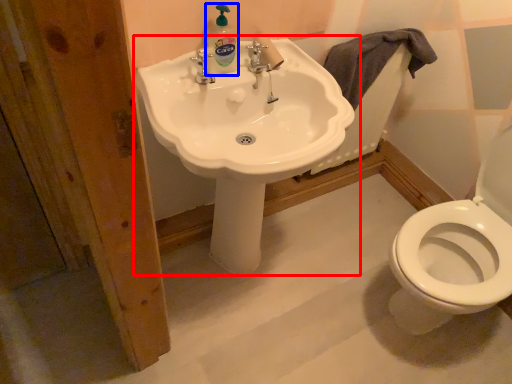
Question: Which point is closer to the camera, sink (highlighted by a red box) or cleaning product (highlighted by a blue box)?

Choices:
 (A) sink
 (B) cleaning product

Answer: (A)